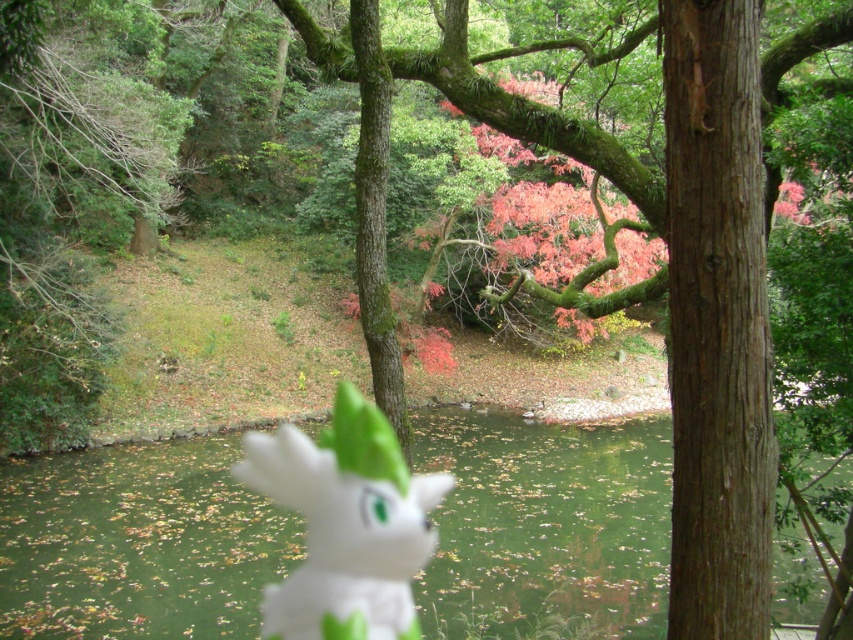
Which is behind, point (45, 605) or point (337, 531)?

Positioned behind is point (337, 531).

What do you see at coordinates (544, 528) in the screenshot? I see `green matte lake at center` at bounding box center [544, 528].

You are a GUI agent. You are given a task and a screenshot of the screen. Output one action in this format:
    pyautogui.click(x=<x>, y=<y>)
    Task: Click on the green matte lake at center
    
    Given the screenshot: What is the action you would take?
    pyautogui.click(x=544, y=528)

Find the location of a particular element. Image resolution: width=853 pixels, height=640 pixels. green matte lake at center is located at coordinates (544, 528).

Is white matte plush at center smaller than green mossy branch at upper center?

Correct, white matte plush at center occupies less space than green mossy branch at upper center.

Consider the image. Which is more to the left, white matte plush at center or green mossy branch at upper center?

Positioned to the left is white matte plush at center.

Which is behind, point (350, 625) or point (643, 230)?

Positioned behind is point (643, 230).

What are the coordinates of `white matte plush at center` in the screenshot? It's located at (345, 524).

In the scene shown: Between green matte lake at center and green mossy branch at upper center, which one has more height?

With more height is green mossy branch at upper center.

In the scene shown: Does green matte lake at center have a larger size compared to green mossy branch at upper center?

No, green matte lake at center is not bigger than green mossy branch at upper center.

Image resolution: width=853 pixels, height=640 pixels. I want to click on green matte lake at center, so click(544, 528).

What are the coordinates of `green matte lake at center` in the screenshot? It's located at (544, 528).